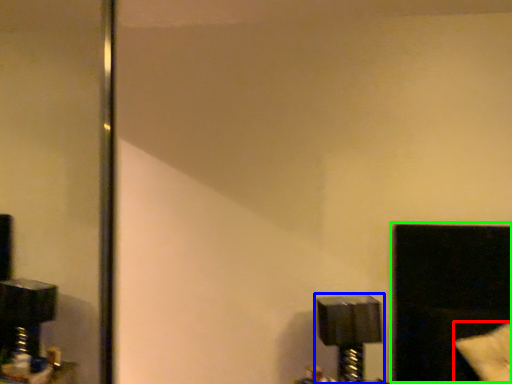
Question: Estimate the real-world distances between objects in this image. Which object is farther from pillow (highlighted by a red box), lamp (highlighted by a blue box) or window (highlighted by a green box)?

Choices:
 (A) lamp
 (B) window

Answer: (A)